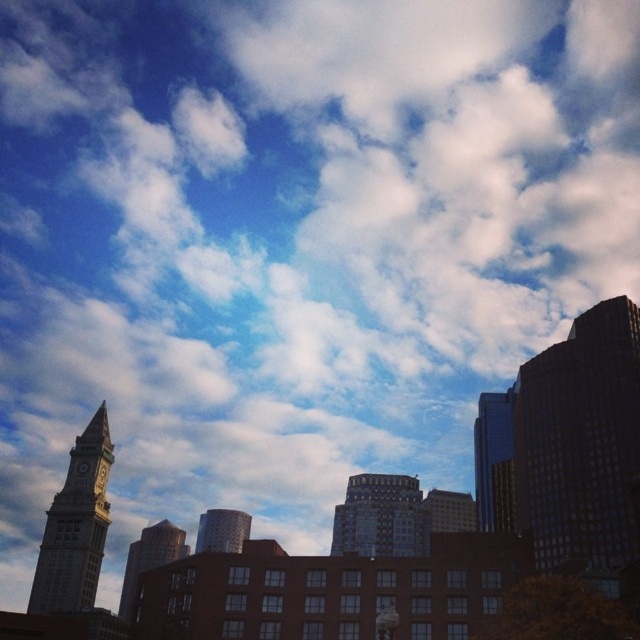
You are an architect designing a new city park between the dark glass skyscraper at right and the gold metallic clock at lower left. Which structure should you consider for the park entrance to ensure it is more visible from the main road?

The dark glass skyscraper at right should be considered for the park entrance because its width is larger than the gold metallic clock at lower left, making it more prominent and visible from the main road.